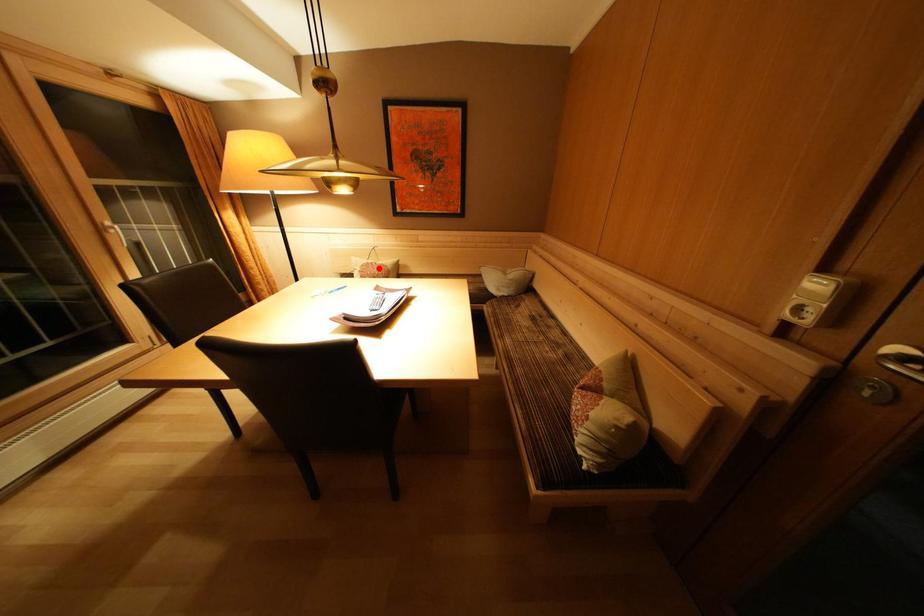
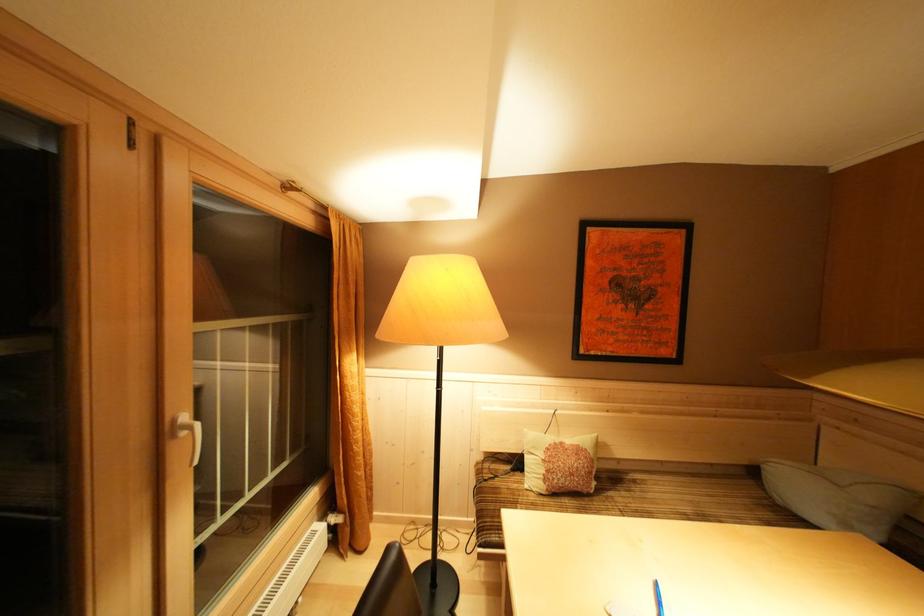
Question: I am providing you with two images of the same scene from different viewpoints. In image1, a red point is highlighted. Considering the same 3D point in image2, which of the following is correct?

Choices:
 (A) It is closer
 (B) It is farther

Answer: (B)